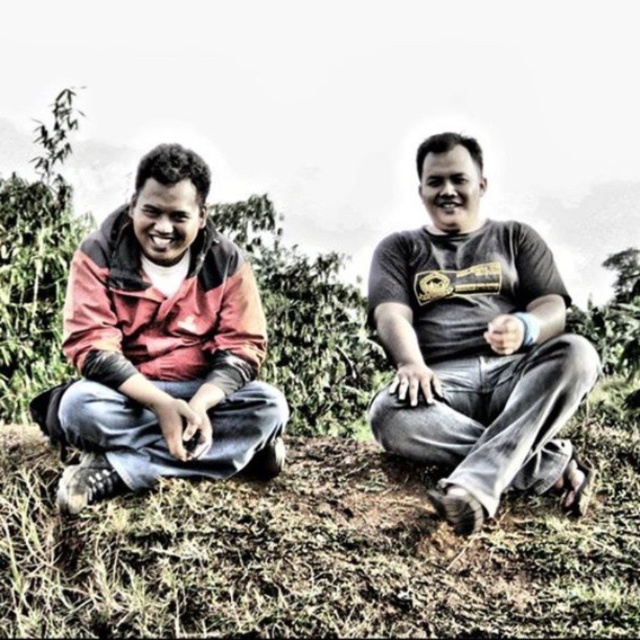
You are planning to place a small potted plant on the ground near the matte red jacket at left. Based on the scene, where should you place the plant to ensure it sits on the green grass at center?

The green grass at center is positioned under the matte red jacket at left, so placing the potted plant directly beneath the matte red jacket at left would ensure it sits on the green grass at center.